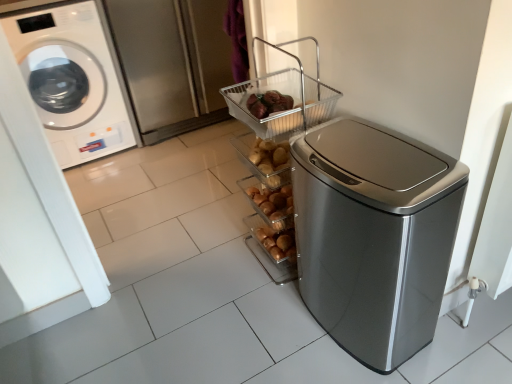
Image resolution: width=512 pixels, height=384 pixels. What are the coordinates of `vacant area that lies to the right of satin silver trash can at right` in the screenshot? It's located at tap(466, 335).